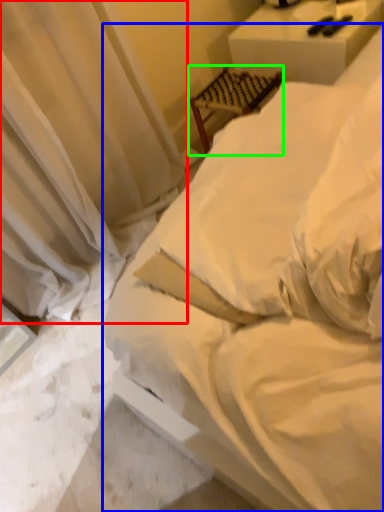
Question: Considering the real-world distances, which object is closest to curtain (highlighted by a red box)? bed (highlighted by a blue box) or furniture (highlighted by a green box).

Choices:
 (A) bed
 (B) furniture

Answer: (B)